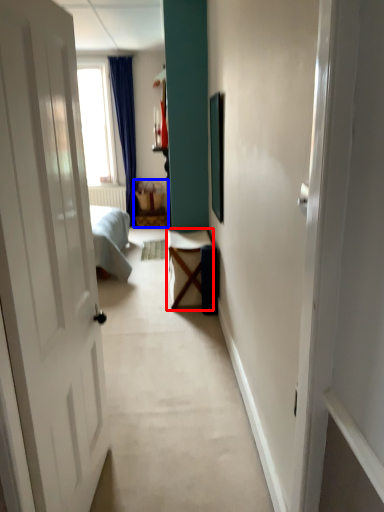
Question: Among these objects, which one is nearest to the camera, table (highlighted by a red box) or furniture (highlighted by a blue box)?

Choices:
 (A) table
 (B) furniture

Answer: (A)